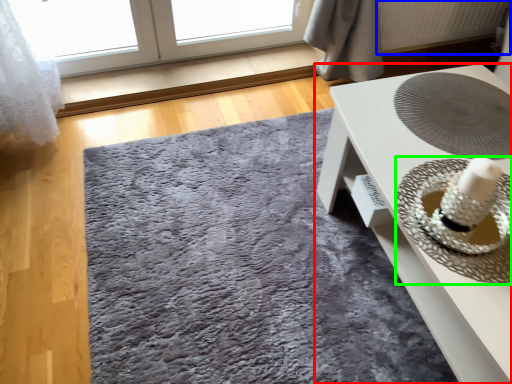
Question: Which object is positioned closest to table (highlighted by a red box)? Select from radiator (highlighted by a blue box) and straw hat (highlighted by a green box).

Choices:
 (A) radiator
 (B) straw hat

Answer: (B)